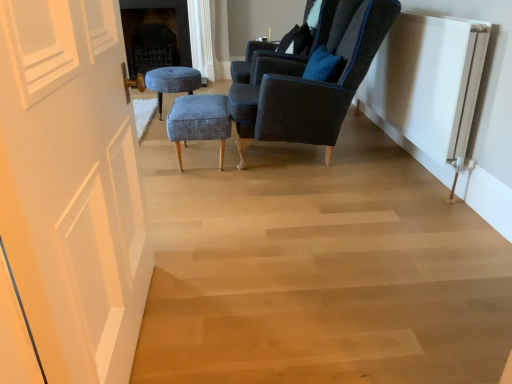
Question: Are velvet dark blue armchair at center, marked as the second chair in a back-to-front arrangement, and velvet dark blue armchair at upper right, positioned as the first chair in back-to-front order, beside each other?

Choices:
 (A) yes
 (B) no

Answer: (B)

Question: Considering the relative sizes of velvet dark blue armchair at center, marked as the second chair in a back-to-front arrangement, and velvet dark blue armchair at upper right, the 2th chair from the front, in the image provided, is velvet dark blue armchair at center, marked as the second chair in a back-to-front arrangement, bigger than velvet dark blue armchair at upper right, the 2th chair from the front,?

Choices:
 (A) yes
 (B) no

Answer: (A)

Question: Is velvet dark blue armchair at center, the 1th chair viewed from the front, shorter than velvet dark blue armchair at upper right, positioned as the first chair in back-to-front order?

Choices:
 (A) yes
 (B) no

Answer: (B)

Question: Does velvet dark blue armchair at center, the 1th chair viewed from the front, lie behind velvet dark blue armchair at upper right, the 2th chair from the front?

Choices:
 (A) no
 (B) yes

Answer: (A)

Question: From the image's perspective, is velvet dark blue armchair at center, marked as the second chair in a back-to-front arrangement, beneath velvet dark blue armchair at upper right, the 2th chair from the front?

Choices:
 (A) yes
 (B) no

Answer: (A)

Question: Considering the relative positions of velvet dark blue armchair at center, marked as the second chair in a back-to-front arrangement, and velvet dark blue armchair at upper right, positioned as the first chair in back-to-front order, in the image provided, is velvet dark blue armchair at center, marked as the second chair in a back-to-front arrangement, to the right of velvet dark blue armchair at upper right, positioned as the first chair in back-to-front order, from the viewer's perspective?

Choices:
 (A) yes
 (B) no

Answer: (A)

Question: Is white ribbed radiator at right to the left of velvet blue stool at center, which is counted as the 2th stool, starting from the bottom, from the viewer's perspective?

Choices:
 (A) no
 (B) yes

Answer: (A)

Question: Is the position of white ribbed radiator at right more distant than that of velvet blue stool at center, arranged as the first stool when viewed from the back?

Choices:
 (A) yes
 (B) no

Answer: (B)

Question: From the image's perspective, does white ribbed radiator at right appear lower than velvet blue stool at center, which appears as the 1th stool when viewed from the top?

Choices:
 (A) yes
 (B) no

Answer: (A)

Question: Are white ribbed radiator at right and velvet blue stool at center, marked as the 1th stool in a left-to-right arrangement, far apart?

Choices:
 (A) yes
 (B) no

Answer: (A)

Question: Does white ribbed radiator at right have a lesser height compared to velvet blue stool at center, the second stool from the right?

Choices:
 (A) no
 (B) yes

Answer: (A)

Question: From a real-world perspective, is white ribbed radiator at right physically below velvet blue stool at center, which is counted as the 2th stool, starting from the bottom?

Choices:
 (A) yes
 (B) no

Answer: (B)

Question: Is white ribbed radiator at right looking in the opposite direction of velvet dark blue armchair at upper right, positioned as the first chair in back-to-front order?

Choices:
 (A) no
 (B) yes

Answer: (A)